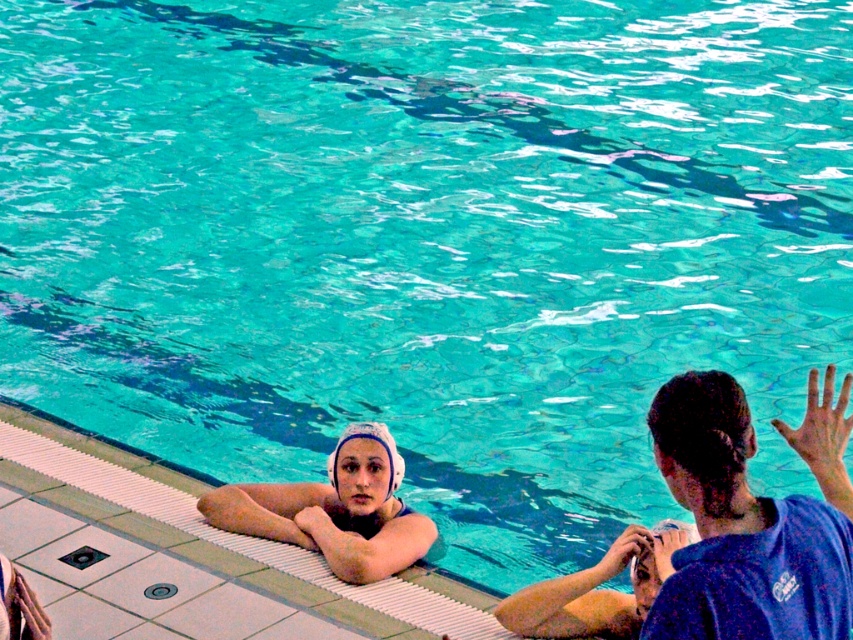
Is blue cotton shirt at upper right thinner than white matte swim cap at upper center?

Yes.

Between point (721, 388) and point (289, 508), which one is positioned behind?

The point (289, 508) is more distant.

Identify the location of blue cotton shirt at upper right. (751, 518).

Find the location of a particular element. This screenshot has height=640, width=853. blue cotton shirt at upper right is located at coordinates (751, 518).